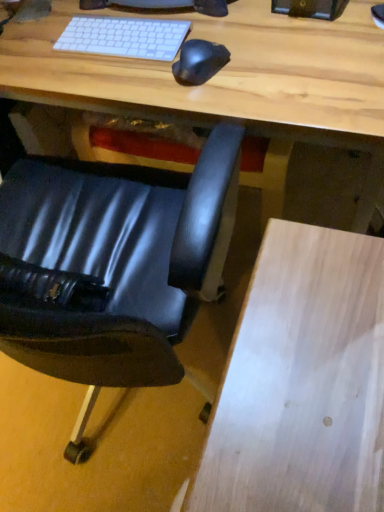
Question: Does light wood desk at center have a larger size compared to black rubber mouse at center?

Choices:
 (A) yes
 (B) no

Answer: (A)

Question: Does light wood desk at center have a lesser width compared to black rubber mouse at center?

Choices:
 (A) yes
 (B) no

Answer: (B)

Question: Is light wood desk at center to the right of black rubber mouse at center from the viewer's perspective?

Choices:
 (A) no
 (B) yes

Answer: (B)

Question: Considering the relative sizes of light wood desk at center and black rubber mouse at center in the image provided, is light wood desk at center smaller than black rubber mouse at center?

Choices:
 (A) no
 (B) yes

Answer: (A)

Question: Is light wood desk at center wider than black rubber mouse at center?

Choices:
 (A) no
 (B) yes

Answer: (B)

Question: Does light wood desk at center appear on the left side of black rubber mouse at center?

Choices:
 (A) yes
 (B) no

Answer: (B)

Question: Does black leather chair at lower left have a greater width compared to black rubber mouse at center?

Choices:
 (A) yes
 (B) no

Answer: (A)

Question: Is black leather chair at lower left smaller than black rubber mouse at center?

Choices:
 (A) no
 (B) yes

Answer: (A)

Question: From the image's perspective, is black leather chair at lower left beneath black rubber mouse at center?

Choices:
 (A) no
 (B) yes

Answer: (B)

Question: Is black leather chair at lower left at the left side of black rubber mouse at center?

Choices:
 (A) no
 (B) yes

Answer: (B)

Question: Does black leather chair at lower left have a greater height compared to black rubber mouse at center?

Choices:
 (A) no
 (B) yes

Answer: (B)

Question: From a real-world perspective, is black leather chair at lower left positioned under black rubber mouse at center based on gravity?

Choices:
 (A) yes
 (B) no

Answer: (A)

Question: Could light wood desk at center be considered to be inside black rubber mouse at center?

Choices:
 (A) yes
 (B) no

Answer: (B)